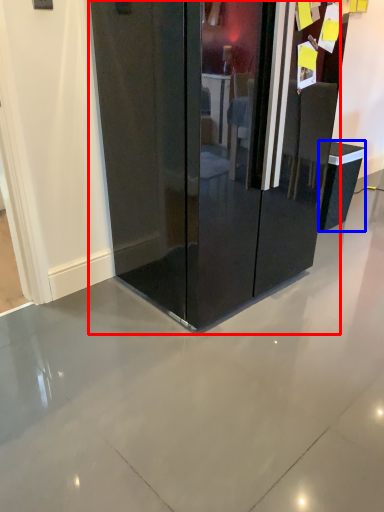
Question: Which object appears closest to the camera in this image, glass door (highlighted by a red box) or furniture (highlighted by a blue box)?

Choices:
 (A) glass door
 (B) furniture

Answer: (A)